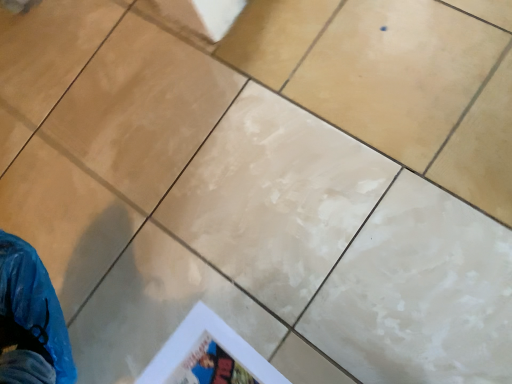
In order to face matte beige tile at center, should I rotate leftwards or rightwards?

To face it directly, rotate right by 16.382 degrees.

Where is `matte beige tile at center`? The width and height of the screenshot is (512, 384). matte beige tile at center is located at coordinates (397, 74).

Describe the element at coordinates (397, 74) in the screenshot. The height and width of the screenshot is (384, 512). I see `matte beige tile at center` at that location.

The image size is (512, 384). Identify the location of white paper poster at lower center. (208, 356).

The height and width of the screenshot is (384, 512). What do you see at coordinates (208, 356) in the screenshot?
I see `white paper poster at lower center` at bounding box center [208, 356].

Where is `matte beige tile at center`? This screenshot has height=384, width=512. matte beige tile at center is located at coordinates (397, 74).

Is matte beige tile at center to the left or to the right of white paper poster at lower center in the image?

In the image, matte beige tile at center appears on the right side of white paper poster at lower center.

Between matte beige tile at center and white paper poster at lower center, which one is positioned in front?

white paper poster at lower center is closer to the camera.

Which is behind, point (351, 86) or point (226, 353)?

The point (351, 86) is behind.

From the image's perspective, between matte beige tile at center and white paper poster at lower center, which one is located above?

matte beige tile at center appears higher in the image.

From a real-world perspective, relative to white paper poster at lower center, is matte beige tile at center vertically above or below?

matte beige tile at center is situated higher than white paper poster at lower center in the real world.

Looking at their sizes, would you say matte beige tile at center is wider or thinner than white paper poster at lower center?

In the image, matte beige tile at center appears to be wider than white paper poster at lower center.

Who is taller, matte beige tile at center or white paper poster at lower center?

Standing taller between the two is white paper poster at lower center.

Based on their sizes in the image, would you say matte beige tile at center is bigger or smaller than white paper poster at lower center?

matte beige tile at center is bigger than white paper poster at lower center.

Is matte beige tile at center not inside white paper poster at lower center?

That's correct, matte beige tile at center is outside of white paper poster at lower center.

Is the surface of matte beige tile at center in direct contact with white paper poster at lower center?

matte beige tile at center and white paper poster at lower center are not in contact.

Does matte beige tile at center turn towards white paper poster at lower center?

Yes.

The image size is (512, 384). In the image, there is a matte beige tile at center. Identify the location of poster page below it (from the image's perspective). (208, 356).

Does white paper poster at lower center appear on the right side of matte beige tile at center?

In fact, white paper poster at lower center is to the left of matte beige tile at center.

Looking at this image, considering the positions of objects white paper poster at lower center and matte beige tile at center in the image provided, who is in front, white paper poster at lower center or matte beige tile at center?

white paper poster at lower center is in front.

Is point (238, 339) behind point (413, 157)?

No.

From the image's perspective, is white paper poster at lower center on top of matte beige tile at center?

No.

From a real-world perspective, is white paper poster at lower center positioned above or below matte beige tile at center?

From a real-world perspective, white paper poster at lower center is physically below matte beige tile at center.

Considering the sizes of white paper poster at lower center and matte beige tile at center in the image, is white paper poster at lower center wider or thinner than matte beige tile at center?

white paper poster at lower center is thinner than matte beige tile at center.

Consider the image. Does white paper poster at lower center have a greater height compared to matte beige tile at center?

Yes.

Who is bigger, white paper poster at lower center or matte beige tile at center?

With larger size is matte beige tile at center.

Would you say white paper poster at lower center is outside matte beige tile at center?

That's correct, white paper poster at lower center is outside of matte beige tile at center.

Is white paper poster at lower center far from matte beige tile at center?

No.

Is white paper poster at lower center positioned with its back to matte beige tile at center?

No, white paper poster at lower center is not facing the opposite direction of matte beige tile at center.

How much distance is there between white paper poster at lower center and matte beige tile at center?

20.70 inches.

There is a white paper poster at lower center. At what (x,y) coordinates should I click in order to perform the action: click on ceramic tile above it (from a real-world perspective). Please return your answer as a coordinate pair (x, y). Looking at the image, I should click on (397, 74).

I want to click on poster page located below the matte beige tile at center (from the image's perspective), so click(x=208, y=356).

The height and width of the screenshot is (384, 512). In order to click on poster page in front of the matte beige tile at center in this screenshot , I will do `click(208, 356)`.